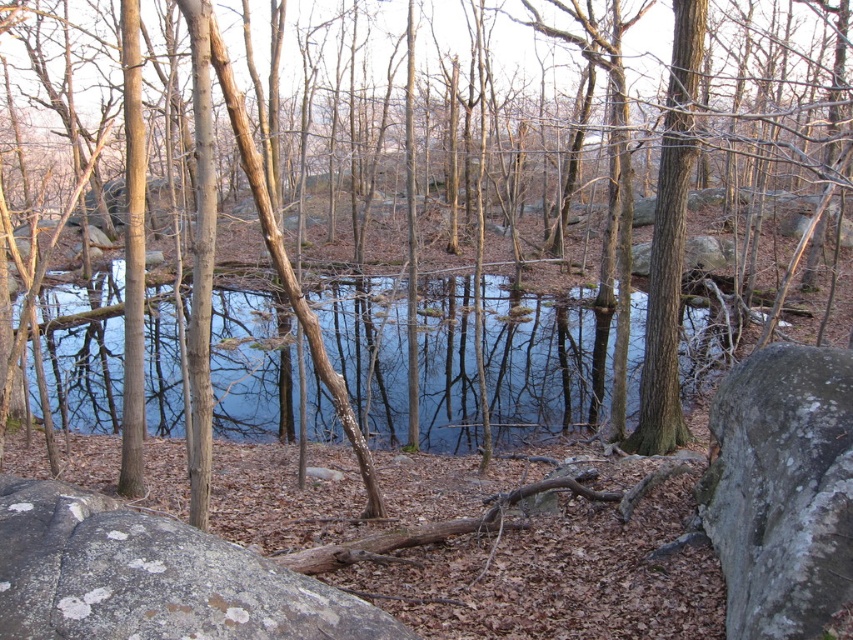
Question: Does clear water at center have a smaller size compared to gray rough rock at lower right?

Choices:
 (A) yes
 (B) no

Answer: (B)

Question: Which of these objects is positioned closest to the gray rough rock at lower right?

Choices:
 (A) clear water at center
 (B) speckled gray rock at center

Answer: (B)

Question: Which of the following is the farthest from the observer?

Choices:
 (A) (331, 410)
 (B) (126, 589)

Answer: (A)

Question: Which of the following is the closest to the observer?

Choices:
 (A) speckled gray rock at center
 (B) gray rough rock at lower right
 (C) clear water at center

Answer: (A)

Question: Is clear water at center to the right of gray rough rock at lower right from the viewer's perspective?

Choices:
 (A) yes
 (B) no

Answer: (B)

Question: Does clear water at center lie behind gray rough rock at lower right?

Choices:
 (A) no
 (B) yes

Answer: (B)